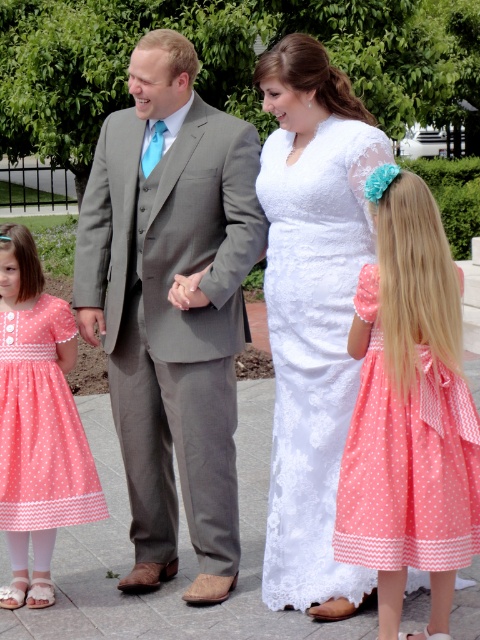
Question: Observing the image, what is the correct spatial positioning of matte gray suit at center in reference to white lace dress at center?

Choices:
 (A) right
 (B) left

Answer: (B)

Question: Which object appears closest to the camera in this image?

Choices:
 (A) coral polka dot dress at lower right
 (B) matte gray suit at center

Answer: (A)

Question: Based on their relative distances, which object is nearer to the coral polka dot dress at lower left?

Choices:
 (A) coral polka dot dress at lower right
 (B) matte gray suit at center

Answer: (B)

Question: Among these points, which one is nearest to the camera?

Choices:
 (A) (0, 422)
 (B) (347, 472)
 (C) (375, 140)
 (D) (196, 328)

Answer: (B)

Question: Does matte gray suit at center have a larger size compared to coral polka dot dress at lower right?

Choices:
 (A) no
 (B) yes

Answer: (B)

Question: Can you confirm if coral polka dot dress at lower right is bigger than white lace dress at center?

Choices:
 (A) no
 (B) yes

Answer: (A)